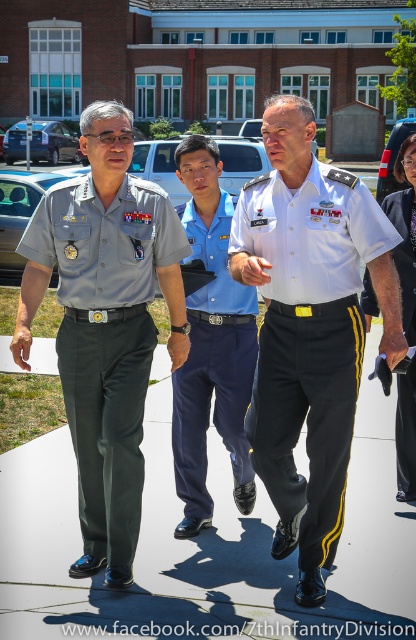
Question: Which object appears closest to the camera in this image?

Choices:
 (A) blue cotton shirt at center
 (B) white cotton shirt at center
 (C) black smooth pants at right
 (D) matte gray uniform at left

Answer: (B)

Question: Which of the following is the farthest from the observer?

Choices:
 (A) black smooth pants at right
 (B) white cotton shirt at center

Answer: (A)

Question: Does matte gray uniform at left have a greater width compared to black smooth pants at right?

Choices:
 (A) no
 (B) yes

Answer: (B)

Question: Is matte gray uniform at left positioned behind blue cotton shirt at center?

Choices:
 (A) yes
 (B) no

Answer: (B)

Question: Is dark gray concrete pavement at center smaller than black smooth pants at right?

Choices:
 (A) yes
 (B) no

Answer: (B)

Question: Which point is farther to the camera?

Choices:
 (A) (180, 212)
 (B) (74, 541)
 (C) (118, 340)

Answer: (A)